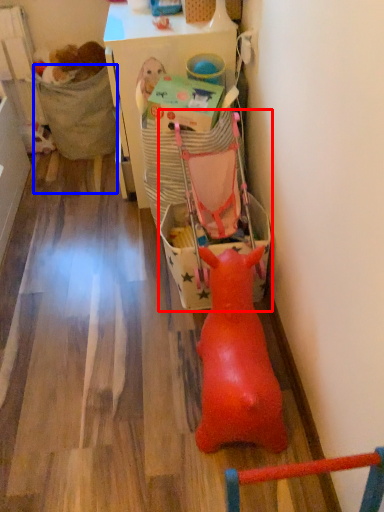
Question: Which object is closer to the camera taking this photo, baby carriage (highlighted by a red box) or chair (highlighted by a blue box)?

Choices:
 (A) baby carriage
 (B) chair

Answer: (A)